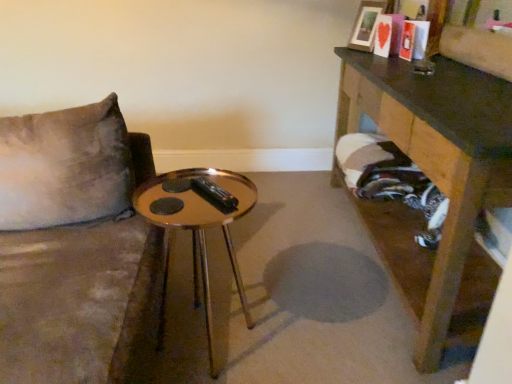
What do you see at coordinates (435, 167) in the screenshot?
I see `wooden table at right, which is the 1th table from right to left` at bounding box center [435, 167].

In order to click on wooden table at right, which is the 1th table from right to left in this screenshot , I will do `click(435, 167)`.

You are a GUI agent. You are given a task and a screenshot of the screen. Output one action in this format:
    pyautogui.click(x=<x>, y=<y>)
    Task: Click on the wooden table at right, the 2th table from the left
    The width and height of the screenshot is (512, 384).
    Given the screenshot: What is the action you would take?
    pyautogui.click(x=435, y=167)

Find the location of `picture frame located above the wooden table at right, which is the 1th table from right to left (from the image's perspective)`. picture frame located above the wooden table at right, which is the 1th table from right to left (from the image's perspective) is located at coordinates (366, 25).

Could you tell me if wooden table at right, which is the 1th table from right to left, is facing wooden picture frame at upper right?

No, wooden table at right, which is the 1th table from right to left, is not facing towards wooden picture frame at upper right.

Measure the distance from wooden table at right, the 2th table from the left, to wooden picture frame at upper right.

wooden table at right, the 2th table from the left, and wooden picture frame at upper right are 28.18 inches apart.

From the image's perspective, is wooden table at right, which is the 1th table from right to left, located above or below wooden picture frame at upper right?

Based on their image positions, wooden table at right, which is the 1th table from right to left, is located beneath wooden picture frame at upper right.

Can you confirm if wooden picture frame at upper right is shorter than wooden table at right, the 2th table from the left?

Yes, wooden picture frame at upper right is shorter than wooden table at right, the 2th table from the left.

Which is further, (372, 37) or (417, 300)?

The point (372, 37) is farther.

Identify the location of picture frame above the wooden table at right, the 2th table from the left (from a real-world perspective). (366, 25).

Is wooden picture frame at upper right looking in the opposite direction of wooden table at right, the 2th table from the left?

No.

From the image's perspective, relative to wooden table at right, the 2th table from the left, is gold reflective table at center, which appears as the 2th table when viewed from the right, above or below?

gold reflective table at center, which appears as the 2th table when viewed from the right, is below wooden table at right, the 2th table from the left.

Measure the distance from gold reflective table at center, which appears as the 2th table when viewed from the right, to wooden table at right, which is the 1th table from right to left.

→ They are 31.47 inches apart.

Is point (213, 223) closer or farther from the camera than point (467, 105)?

Point (213, 223).

Is gold reflective table at center, which appears as the 2th table when viewed from the right, bigger than wooden table at right, the 2th table from the left?

No, gold reflective table at center, which appears as the 2th table when viewed from the right, is not bigger than wooden table at right, the 2th table from the left.

Do you think wooden table at right, which is the 1th table from right to left, is within gold reflective table at center, which appears as the 2th table when viewed from the right, or outside of it?

wooden table at right, which is the 1th table from right to left, is spatially situated outside gold reflective table at center, which appears as the 2th table when viewed from the right.

Does wooden table at right, the 2th table from the left, turn towards gold reflective table at center, which appears as the 2th table when viewed from the right?

Yes, wooden table at right, the 2th table from the left, faces towards gold reflective table at center, which appears as the 2th table when viewed from the right.

Considering the relative sizes of wooden table at right, which is the 1th table from right to left, and gold reflective table at center, placed as the first table when sorted from left to right, in the image provided, is wooden table at right, which is the 1th table from right to left, wider than gold reflective table at center, placed as the first table when sorted from left to right,?

Yes.

Can you confirm if wooden table at right, which is the 1th table from right to left, is taller than gold reflective table at center, which appears as the 2th table when viewed from the right?

Yes, wooden table at right, which is the 1th table from right to left, is taller than gold reflective table at center, which appears as the 2th table when viewed from the right.

Is gold reflective table at center, placed as the first table when sorted from left to right, oriented towards wooden picture frame at upper right?

No, gold reflective table at center, placed as the first table when sorted from left to right, is not aimed at wooden picture frame at upper right.

From a real-world perspective, is gold reflective table at center, placed as the first table when sorted from left to right, located higher than wooden picture frame at upper right?

Actually, gold reflective table at center, placed as the first table when sorted from left to right, is physically below wooden picture frame at upper right in the real world.

This screenshot has width=512, height=384. Find the location of `picture frame that appears behind the gold reflective table at center, placed as the first table when sorted from left to right`. picture frame that appears behind the gold reflective table at center, placed as the first table when sorted from left to right is located at coordinates (366, 25).

Considering the positions of points (191, 168) and (367, 48), is point (191, 168) farther from camera compared to point (367, 48)?

Yes.

Considering the sizes of objects wooden picture frame at upper right and gold reflective table at center, placed as the first table when sorted from left to right, in the image provided, who is thinner, wooden picture frame at upper right or gold reflective table at center, placed as the first table when sorted from left to right,?

wooden picture frame at upper right.

Identify the location of picture frame on the right of gold reflective table at center, placed as the first table when sorted from left to right. (366, 25).

From the image's perspective, which one is positioned higher, wooden picture frame at upper right or gold reflective table at center, placed as the first table when sorted from left to right?

wooden picture frame at upper right.

Is wooden picture frame at upper right placed right next to gold reflective table at center, placed as the first table when sorted from left to right?

No, wooden picture frame at upper right is not making contact with gold reflective table at center, placed as the first table when sorted from left to right.

The height and width of the screenshot is (384, 512). I want to click on picture frame on the left of wooden table at right, which is the 1th table from right to left, so click(x=366, y=25).

At what (x,y) coordinates should I click in order to perform the action: click on picture frame that appears behind the wooden table at right, the 2th table from the left. Please return your answer as a coordinate pair (x, y). This screenshot has width=512, height=384. Looking at the image, I should click on (366, 25).

Estimate the real-world distances between objects in this image. Which object is closer to wooden table at right, the 2th table from the left, gold reflective table at center, placed as the first table when sorted from left to right, or wooden picture frame at upper right?

wooden picture frame at upper right is closer to wooden table at right, the 2th table from the left.

Which object lies further to the anchor point gold reflective table at center, placed as the first table when sorted from left to right, wooden table at right, the 2th table from the left, or wooden picture frame at upper right?

wooden picture frame at upper right is further to gold reflective table at center, placed as the first table when sorted from left to right.

From the picture: Estimate the real-world distances between objects in this image. Which object is further from wooden table at right, which is the 1th table from right to left, wooden picture frame at upper right or gold reflective table at center, placed as the first table when sorted from left to right?

gold reflective table at center, placed as the first table when sorted from left to right, is further to wooden table at right, which is the 1th table from right to left.

Which object lies further to the anchor point wooden picture frame at upper right, wooden table at right, the 2th table from the left, or gold reflective table at center, which appears as the 2th table when viewed from the right?

The object further to wooden picture frame at upper right is gold reflective table at center, which appears as the 2th table when viewed from the right.

Considering their positions, is gold reflective table at center, which appears as the 2th table when viewed from the right, positioned further to wooden picture frame at upper right than wooden table at right, which is the 1th table from right to left?

Among the two, gold reflective table at center, which appears as the 2th table when viewed from the right, is located further to wooden picture frame at upper right.

Consider the image. Looking at the image, which one is located closer to gold reflective table at center, placed as the first table when sorted from left to right, wooden picture frame at upper right or wooden table at right, the 2th table from the left?

wooden table at right, the 2th table from the left, is closer to gold reflective table at center, placed as the first table when sorted from left to right.

Find the location of a particular element. table located between wooden table at right, which is the 1th table from right to left, and wooden picture frame at upper right in the depth direction is located at coordinates (200, 222).